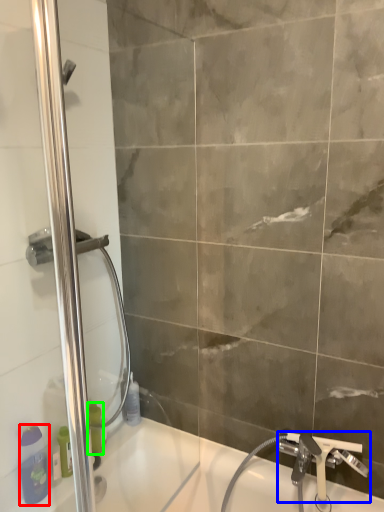
Question: Estimate the real-world distances between objects in this image. Which object is closer to toiletry (highlighted by a red box), tap (highlighted by a blue box) or toiletry (highlighted by a green box)?

Choices:
 (A) tap
 (B) toiletry

Answer: (B)